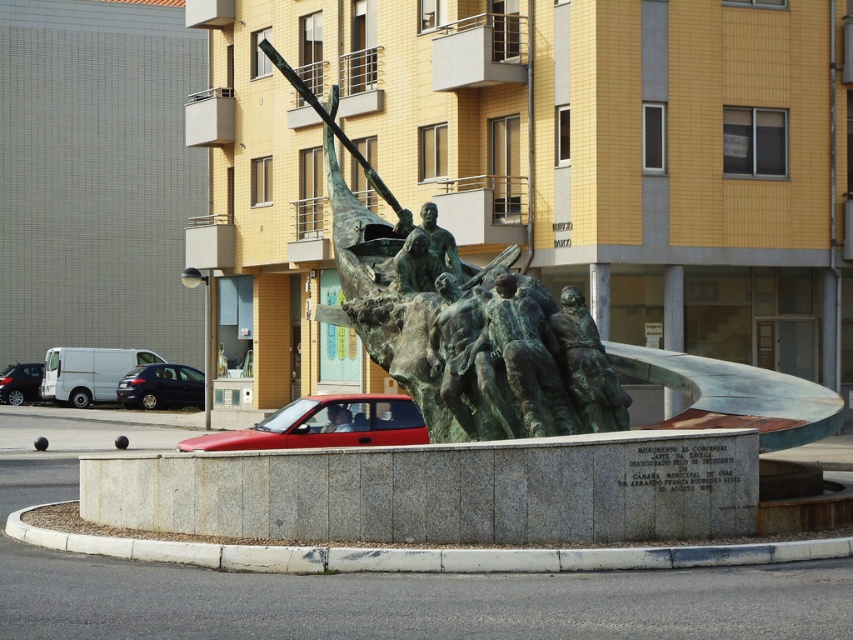
You are a pedestrian standing at the edge of the square facing the bronze sculpture. You see a shiny red car at center and a matte black van at left. Which vehicle is closer to the bronze sculpture?

The shiny red car at center is closer to the bronze sculpture because it is positioned to the right of the matte black van at left, which is further away.

You are a photographer standing at the edge of the public square. You want to take a photo that includes both the bronze statue at center and the shiny black car at lower left. Which object will appear larger in your photo?

The bronze statue at center will appear larger in the photo because it is closer to the viewer than the shiny black car at lower left.

You are standing in front of the bronze sculpture in the public square. You notice two points on the sculpture labeled as point (341, 436) and point (0, 390). If you want to touch the point that is nearest to your face, which one should you reach for?

Point (341, 436) is closer to the camera than point (0, 390), so you should reach for point (341, 436) to touch the one nearest to your face.